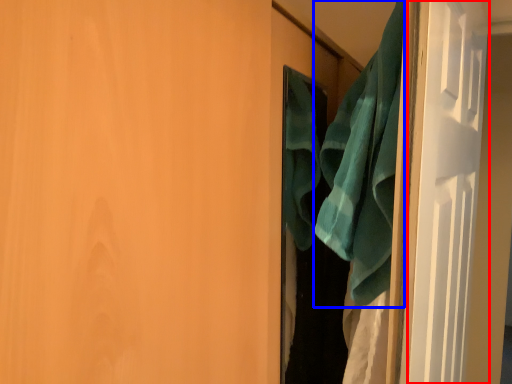
Question: Which object appears closest to the camera in this image, screen door (highlighted by a red box) or beach towel (highlighted by a blue box)?

Choices:
 (A) screen door
 (B) beach towel

Answer: (A)